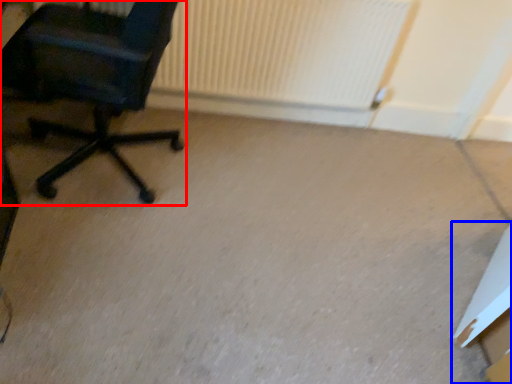
Question: Which object is closer to the camera taking this photo, chair (highlighted by a red box) or cardboard box (highlighted by a blue box)?

Choices:
 (A) chair
 (B) cardboard box

Answer: (A)